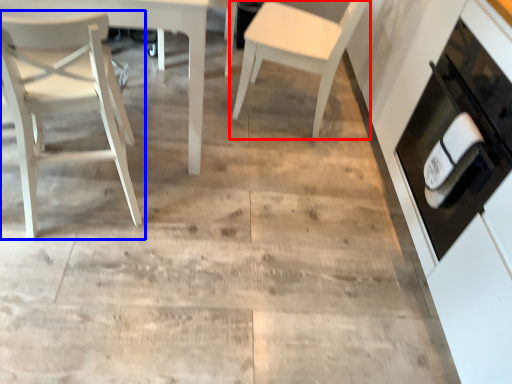
Question: Which point is further to the camera, chair (highlighted by a red box) or chair (highlighted by a blue box)?

Choices:
 (A) chair
 (B) chair

Answer: (A)